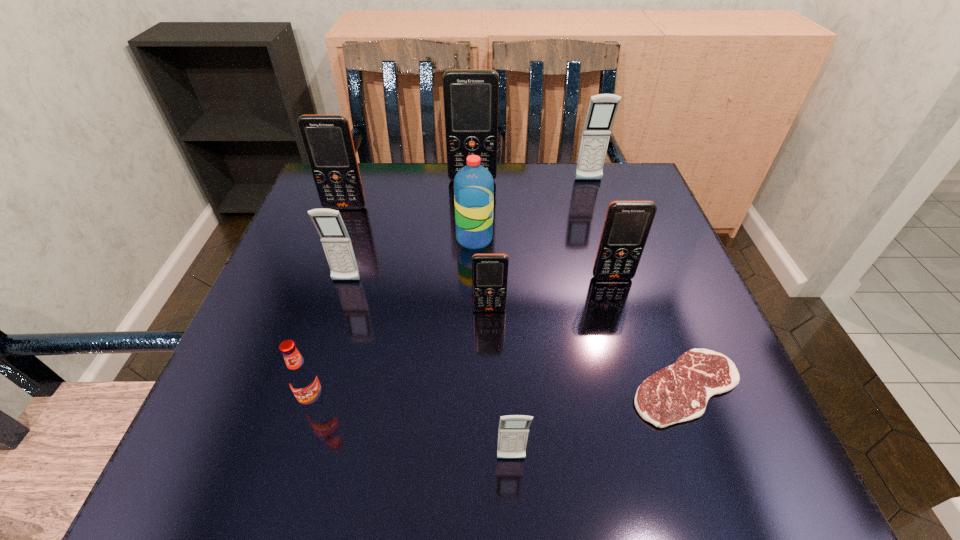
This screenshot has width=960, height=540. What are the coordinates of `vacant space at the near left corner` in the screenshot? It's located at (260, 437).

Find the location of a particular element. The image size is (960, 540). blank space at the far right corner is located at coordinates (616, 174).

The width and height of the screenshot is (960, 540). What are the coordinates of `free space between the red steak and the farthest orange cellular telephone` in the screenshot? It's located at (579, 284).

The height and width of the screenshot is (540, 960). I want to click on vacant space that is in between the second biggest orange cellular telephone and the tallest object, so click(x=409, y=193).

Image resolution: width=960 pixels, height=540 pixels. I want to click on free space between the smallest gray cellular telephone and the steak, so point(598,423).

Locate an element on the screen. This screenshot has width=960, height=540. free space between the root beer and the farthest orange cellular telephone is located at coordinates (394, 291).

At what (x,y) coordinates should I click in order to perform the action: click on free space between the third nearest orange cellular telephone and the fourth nearest object. Please return your answer as a coordinate pair (x, y). Image resolution: width=960 pixels, height=540 pixels. Looking at the image, I should click on (418, 258).

Where is `vacant area that lies between the rightmost gray cellular telephone and the steak`? Image resolution: width=960 pixels, height=540 pixels. vacant area that lies between the rightmost gray cellular telephone and the steak is located at coordinates (637, 284).

What are the coordinates of `vacant area between the seventh farthest object and the third farthest cellular telephone` in the screenshot? It's located at (418, 258).

Identify which object is the second nearest to the root beer. Please provide its 2D coordinates. Your answer should be formatted as a tuple, i.e. [(x, y)], where the tuple contains the x and y coordinates of a point satisfying the conditions above.

[(513, 430)]